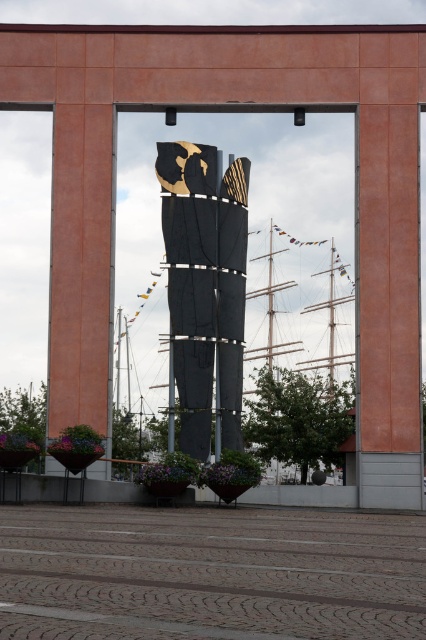
Question: Does black textured fabric at center have a larger size compared to matte orange pillar at center?

Choices:
 (A) yes
 (B) no

Answer: (A)

Question: Can you confirm if black textured fabric at center is positioned above matte orange pillar at center?

Choices:
 (A) yes
 (B) no

Answer: (A)

Question: Among these objects, which one is farthest from the camera?

Choices:
 (A) matte orange pillar at center
 (B) black textured fabric at center

Answer: (B)

Question: Can you confirm if black textured fabric at center is bigger than matte orange pillar at center?

Choices:
 (A) yes
 (B) no

Answer: (A)

Question: Which of the following is the closest to the observer?

Choices:
 (A) (112, 285)
 (B) (224, 268)

Answer: (A)